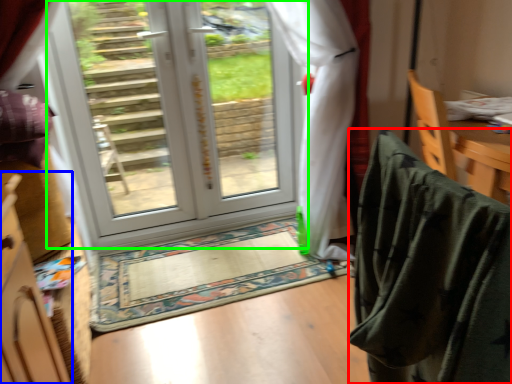
Question: Which object is positioned farthest from blanket (highlighted by a red box)? Select from cabinetry (highlighted by a blue box) and door (highlighted by a green box).

Choices:
 (A) cabinetry
 (B) door

Answer: (B)